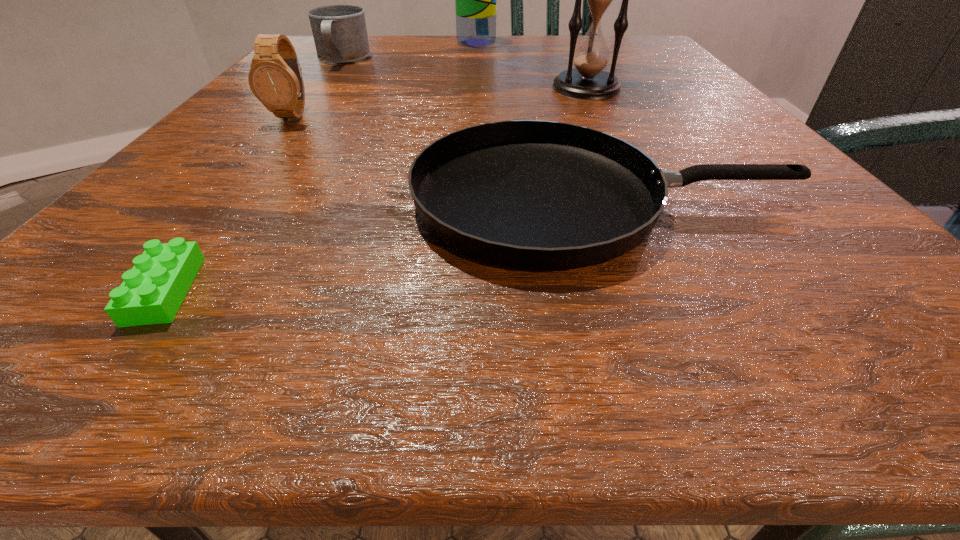
Find the location of a particular element. unoccupied area between the shortest object and the frying pan is located at coordinates (384, 245).

Identify the location of empty space that is in between the fifth nearest object and the hourglass. The height and width of the screenshot is (540, 960). (465, 73).

This screenshot has height=540, width=960. Identify the location of free space between the fourth nearest object and the Lego. (375, 189).

This screenshot has width=960, height=540. Identify the location of vacant point located between the hourglass and the third nearest object. (440, 101).

This screenshot has width=960, height=540. Find the location of `vacant point located between the fourth shortest object and the farthest object`. vacant point located between the fourth shortest object and the farthest object is located at coordinates (385, 79).

Select which object appears as the second closest to the fourth nearest object. Please provide its 2D coordinates. Your answer should be formatted as a tuple, i.e. [(x, y)], where the tuple contains the x and y coordinates of a point satisfying the conditions above.

[(476, 0)]

Where is `object that stands as the second closest to the watch`? The width and height of the screenshot is (960, 540). object that stands as the second closest to the watch is located at coordinates point(536,195).

You are a GUI agent. You are given a task and a screenshot of the screen. Output one action in this format:
    pyautogui.click(x=<x>, y=<y>)
    Task: Click on the free spot that satisfies the following two spatial constraints: 1. on the front label of the farthest object; 2. on the front side of the shortest object
    This screenshot has width=960, height=540.
    Given the screenshot: What is the action you would take?
    pyautogui.click(x=470, y=291)

Where is `free space that satisfies the following two spatial constraints: 1. on the front label of the water bottle; 2. on the back side of the fourth nearest object`? The image size is (960, 540). free space that satisfies the following two spatial constraints: 1. on the front label of the water bottle; 2. on the back side of the fourth nearest object is located at coordinates (475, 87).

At what (x,y) coordinates should I click in order to perform the action: click on vacant area in the image that satisfies the following two spatial constraints: 1. on the front label of the water bottle; 2. on the face of the fourth farthest object. Please return your answer as a coordinate pair (x, y). The width and height of the screenshot is (960, 540). Looking at the image, I should click on (474, 115).